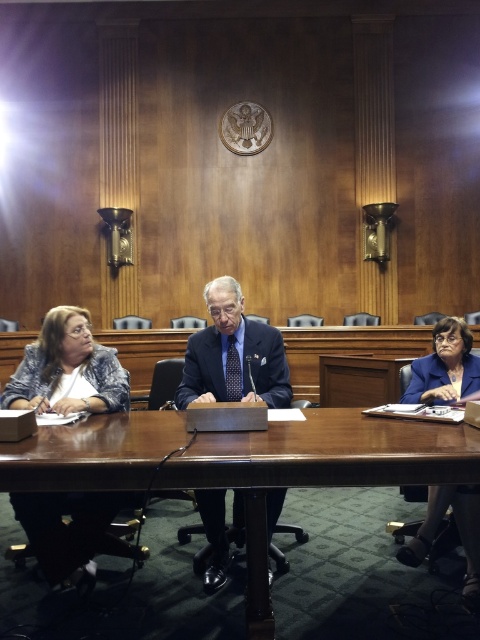
Question: Among these points, which one is farthest from the camera?

Choices:
 (A) (226, 380)
 (B) (43, 566)
 (C) (445, 356)

Answer: (C)

Question: Can you confirm if brown wood table at center is thinner than blue fabric jacket at lower right?

Choices:
 (A) yes
 (B) no

Answer: (B)

Question: Among these points, which one is farthest from the camera?

Choices:
 (A) (478, 604)
 (B) (445, 451)

Answer: (A)

Question: Is blue textured blazer at left further to the viewer compared to dark blue fabric suit at center?

Choices:
 (A) no
 (B) yes

Answer: (A)

Question: Which point is closer to the camera?

Choices:
 (A) (118, 484)
 (B) (470, 545)

Answer: (A)

Question: Does brown wood table at center have a lesser width compared to dark blue fabric suit at center?

Choices:
 (A) no
 (B) yes

Answer: (A)